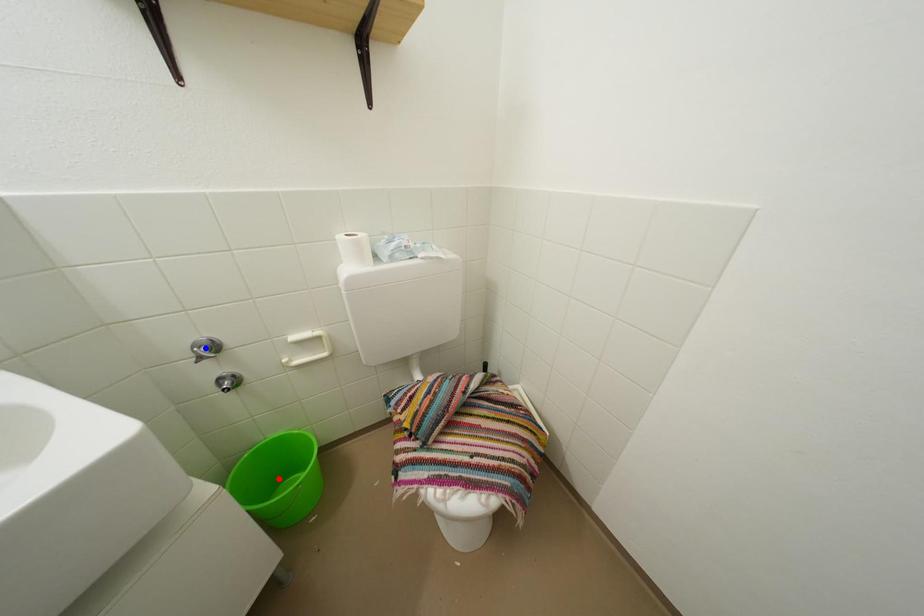
Question: Two points are marked on the image. Which point is closer to the camera?

Choices:
 (A) Blue point is closer.
 (B) Red point is closer.

Answer: (A)